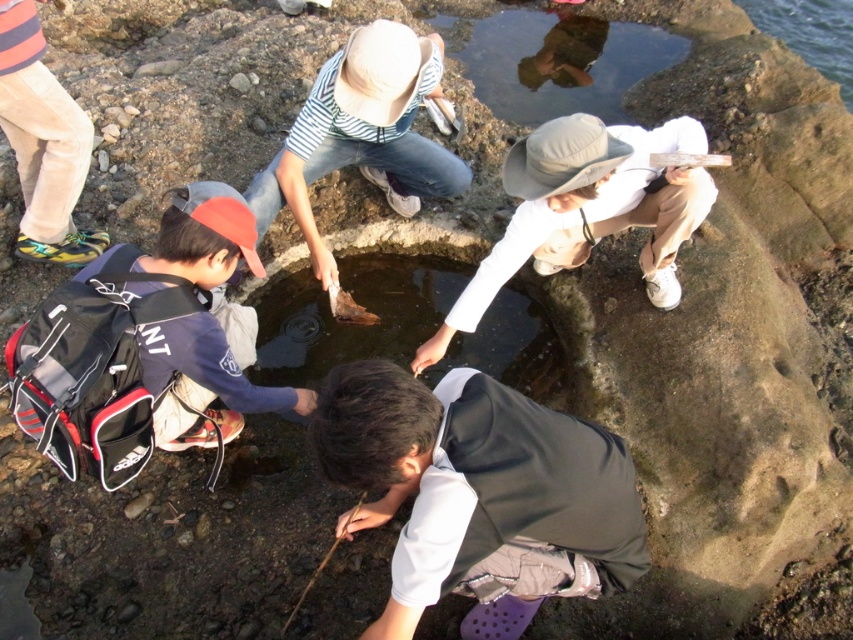
Question: Among these objects, which one is nearest to the camera?

Choices:
 (A) clear water at upper right
 (B) clear water at center

Answer: (B)

Question: Is white matte hat at center to the right of clear water hole at upper center from the viewer's perspective?

Choices:
 (A) yes
 (B) no

Answer: (B)

Question: Based on their relative distances, which object is nearer to the white matte hat at center?

Choices:
 (A) white matte vest at center
 (B) clear water at center
 (C) clear water hole at upper center
 (D) clear water at upper right

Answer: (B)

Question: Can you confirm if white matte vest at center is positioned above clear water at center?

Choices:
 (A) yes
 (B) no

Answer: (B)

Question: Among these points, which one is farthest from the camera?

Choices:
 (A) pos(566,65)
 (B) pos(398,285)
 (C) pos(828,13)
 (D) pos(653,145)

Answer: (C)

Question: Considering the relative positions of clear water at center and clear water at upper right in the image provided, where is clear water at center located with respect to clear water at upper right?

Choices:
 (A) above
 (B) below

Answer: (B)